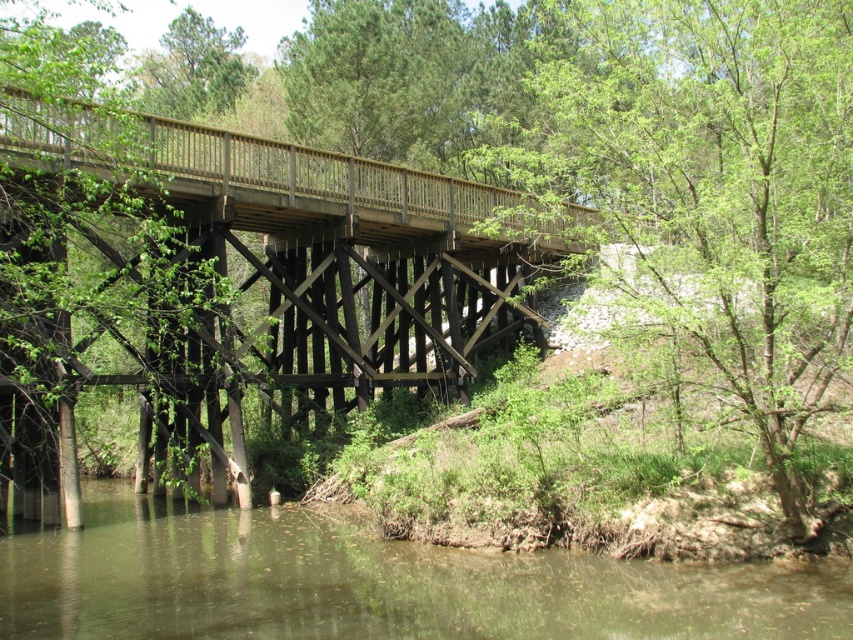
Can you confirm if green leafy tree at center is taller than brown murky water at lower center?

Correct, green leafy tree at center is much taller as brown murky water at lower center.

Can you confirm if green leafy tree at center is smaller than brown murky water at lower center?

Actually, green leafy tree at center might be larger than brown murky water at lower center.

Is point (672, 132) in front of point (119, 525)?

Yes, point (672, 132) is closer to viewer.

Identify the location of green leafy tree at center. Image resolution: width=853 pixels, height=640 pixels. (712, 186).

Which is more to the left, wooden bridge at center or brown murky water at lower center?

wooden bridge at center is more to the left.

Between wooden bridge at center and brown murky water at lower center, which one is positioned lower?

brown murky water at lower center

This screenshot has height=640, width=853. Identify the location of wooden bridge at center. (306, 272).

Who is lower down, green leafy tree at center or wooden bridge at center?

Positioned lower is wooden bridge at center.

Which is behind, point (715, 12) or point (508, 221)?

Positioned behind is point (508, 221).

Is point (682, 156) farther from camera compared to point (136, 120)?

No, it is in front of (136, 120).

You are a GUI agent. You are given a task and a screenshot of the screen. Output one action in this format:
    pyautogui.click(x=<x>, y=<y>)
    Task: Click on the green leafy tree at center
    This screenshot has width=853, height=640.
    Given the screenshot: What is the action you would take?
    pyautogui.click(x=712, y=186)